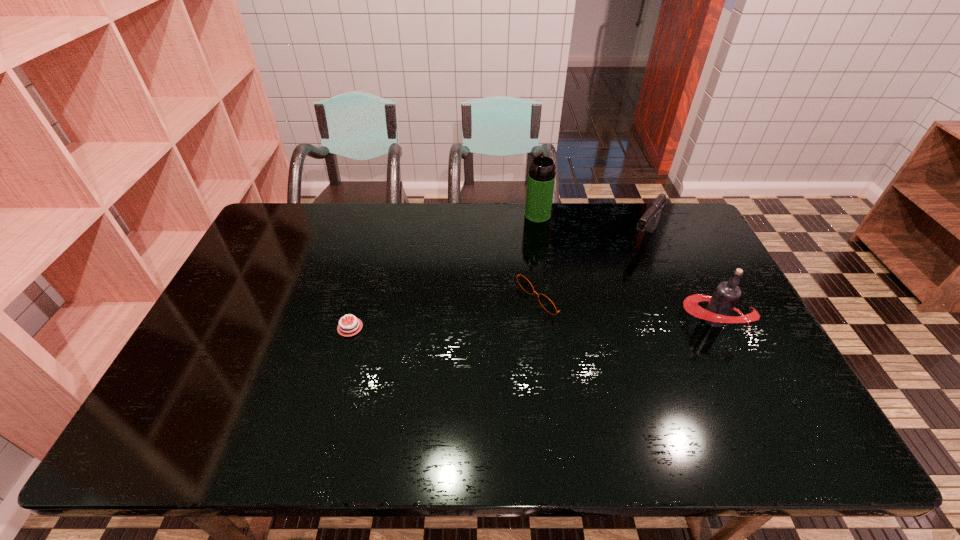
In order to click on chocolate cake in this screenshot , I will do `click(350, 328)`.

I want to click on the leftmost object, so click(x=350, y=328).

This screenshot has width=960, height=540. In order to click on root beer in this screenshot , I will do `click(726, 295)`.

You are a GUI agent. You are given a task and a screenshot of the screen. Output one action in this format:
    pyautogui.click(x=<x>, y=<y>)
    Task: Click on the third shortest object
    
    Given the screenshot: What is the action you would take?
    pyautogui.click(x=649, y=221)

Find the location of a particular element. This screenshot has height=540, width=960. the second farthest object is located at coordinates (649, 221).

Find the location of a particular element. thermos bottle is located at coordinates (541, 178).

This screenshot has height=540, width=960. What are the coordinates of `the farthest object` in the screenshot? It's located at (541, 178).

At what (x,y) coordinates should I click in order to perform the action: click on sunglasses. Please return your answer as a coordinate pair (x, y). Looking at the image, I should click on (547, 304).

The height and width of the screenshot is (540, 960). Find the location of `vacant space situated on the right of the chocolate cake`. vacant space situated on the right of the chocolate cake is located at coordinates (419, 327).

At what (x,y) coordinates should I click in order to perform the action: click on vacant space situated 0.080m aim along the barrel of the pistol. Please return your answer as a coordinate pair (x, y). Image resolution: width=960 pixels, height=540 pixels. Looking at the image, I should click on (628, 264).